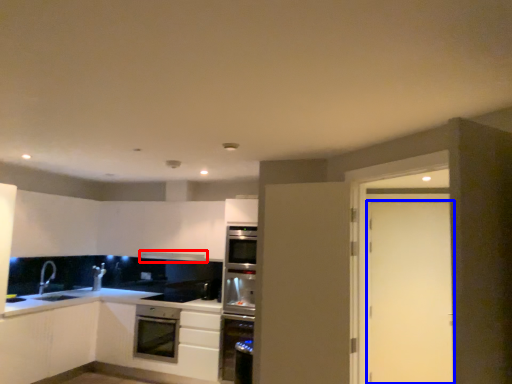
Question: Which of the following is the farthest to the observer, exhaust hood (highlighted by a red box) or door (highlighted by a blue box)?

Choices:
 (A) exhaust hood
 (B) door

Answer: (A)